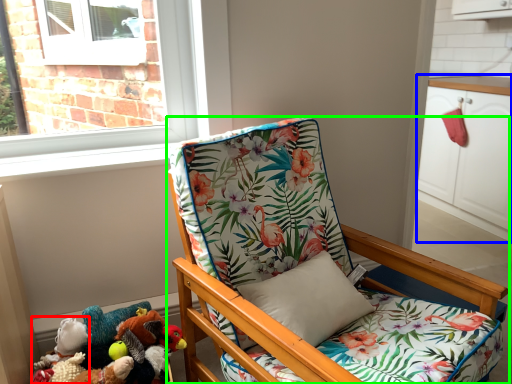
Question: Considering the real-world distances, which object is closest to toy (highlighted by a red box)? cabinetry (highlighted by a blue box) or chair (highlighted by a green box).

Choices:
 (A) cabinetry
 (B) chair

Answer: (B)